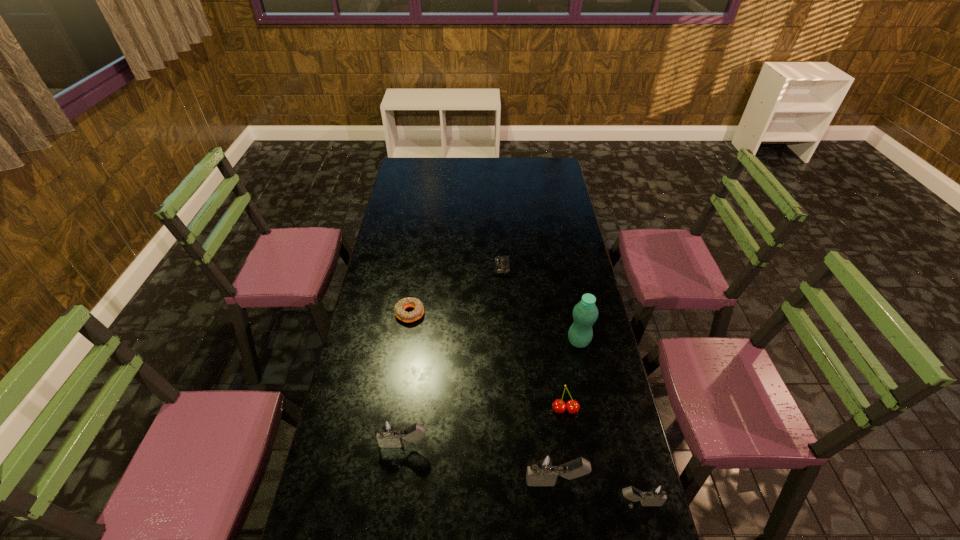
This screenshot has height=540, width=960. What are the coordinates of `location for an additional igniter to make spacing equal` in the screenshot? It's located at (477, 463).